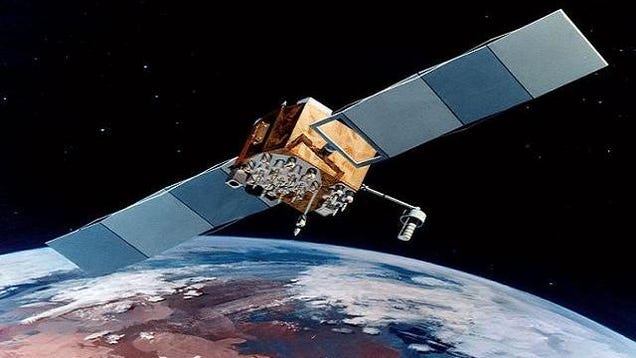
The image size is (636, 358). I want to click on right panel, so click(406, 103).